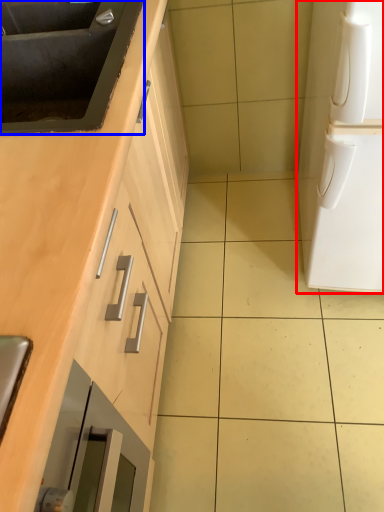
Question: Which of the following is the farthest to the observer, home appliance (highlighted by a red box) or sink (highlighted by a blue box)?

Choices:
 (A) home appliance
 (B) sink

Answer: (B)